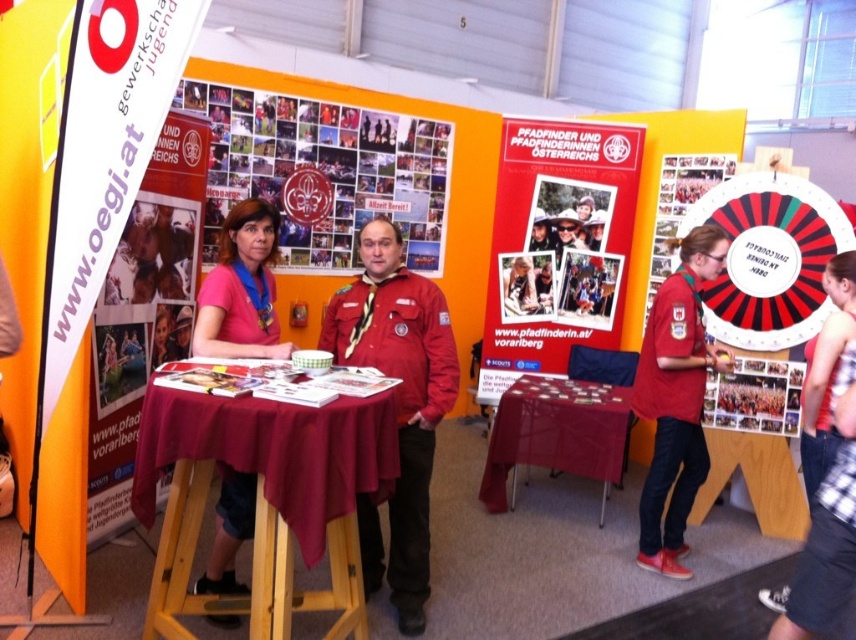
Question: Can you confirm if matte red jacket at center is positioned to the right of red shirt at center?

Choices:
 (A) yes
 (B) no

Answer: (B)

Question: Is orange paper poster at left wider than matte pink shirt at center?

Choices:
 (A) yes
 (B) no

Answer: (B)

Question: Which point appears farthest from the camera in this image?

Choices:
 (A) (413, 465)
 (B) (654, 284)

Answer: (B)

Question: Estimate the real-world distances between objects in this image. Which object is closer to the matte paper collage at center?

Choices:
 (A) matte red jacket at center
 (B) matte paper collage at upper center

Answer: (A)

Question: Can you confirm if matte pink shirt at center is thinner than red shirt at center?

Choices:
 (A) yes
 (B) no

Answer: (A)

Question: Which point is farther from the camera taking this photo?

Choices:
 (A) (836, 388)
 (B) (581, 193)

Answer: (B)